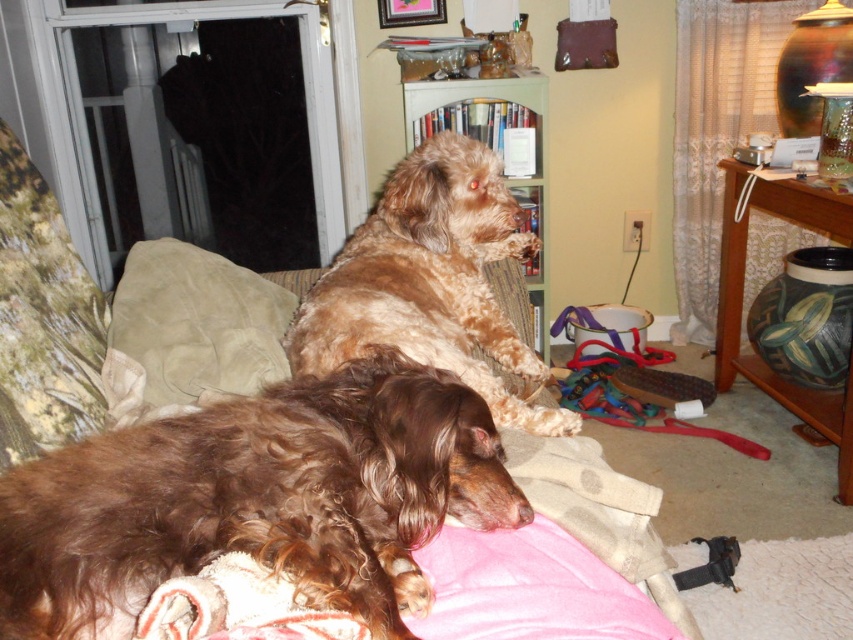
You are trying to place a new throw blanket on the couch where the brown furry dog at upper center and the beige suede pillow at center are located. Based on their sizes, which object takes up more horizontal space on the couch?

The brown furry dog at upper center takes up more horizontal space on the couch because its width surpasses that of the beige suede pillow at center.

What is located at the coordinates point (430, 282)?

At point (430, 282) lies brown furry dog at upper center.